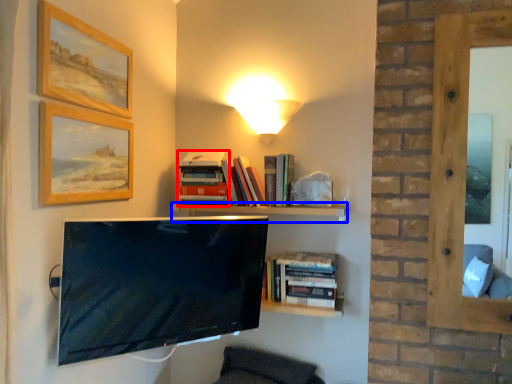
Question: Which object appears closest to the camera in this image, book (highlighted by a red box) or shelf (highlighted by a blue box)?

Choices:
 (A) book
 (B) shelf

Answer: (B)